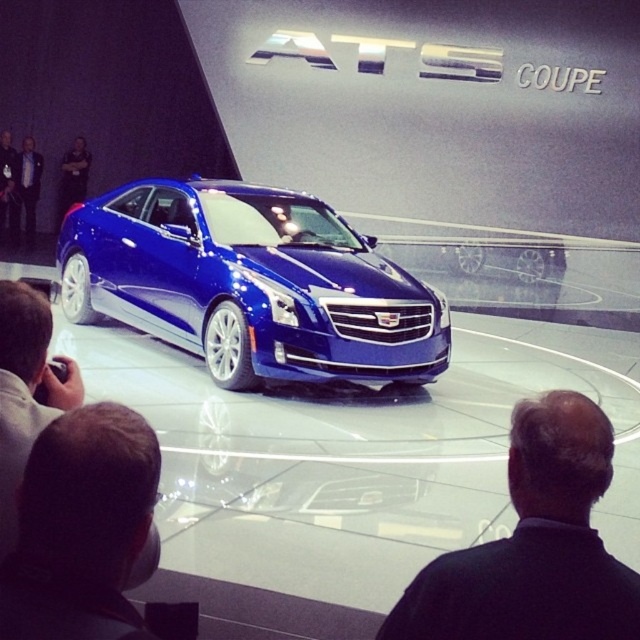
This screenshot has height=640, width=640. What do you see at coordinates (250, 284) in the screenshot? I see `glossy metallic blue car at center` at bounding box center [250, 284].

Is point (250, 323) behind point (40, 156)?

No, (250, 323) is in front of (40, 156).

Identify the location of glossy metallic blue car at center. Image resolution: width=640 pixels, height=640 pixels. (250, 284).

Does black fabric coat at center appear under black leather jacket at upper left?

Correct, black fabric coat at center is located below black leather jacket at upper left.

Can you confirm if black fabric coat at center is taller than black leather jacket at upper left?

No, black fabric coat at center is not taller than black leather jacket at upper left.

The width and height of the screenshot is (640, 640). What do you see at coordinates (532, 545) in the screenshot?
I see `black fabric coat at center` at bounding box center [532, 545].

Identify the location of black fabric coat at center. (532, 545).

Is smooth skin head at lower left positioned behind light gray fabric jacket at lower left?

No, smooth skin head at lower left is closer to the viewer.

Is smooth skin head at lower left to the left of light gray fabric jacket at lower left from the viewer's perspective?

No, smooth skin head at lower left is not to the left of light gray fabric jacket at lower left.

This screenshot has height=640, width=640. Identify the location of smooth skin head at lower left. [x=81, y=528].